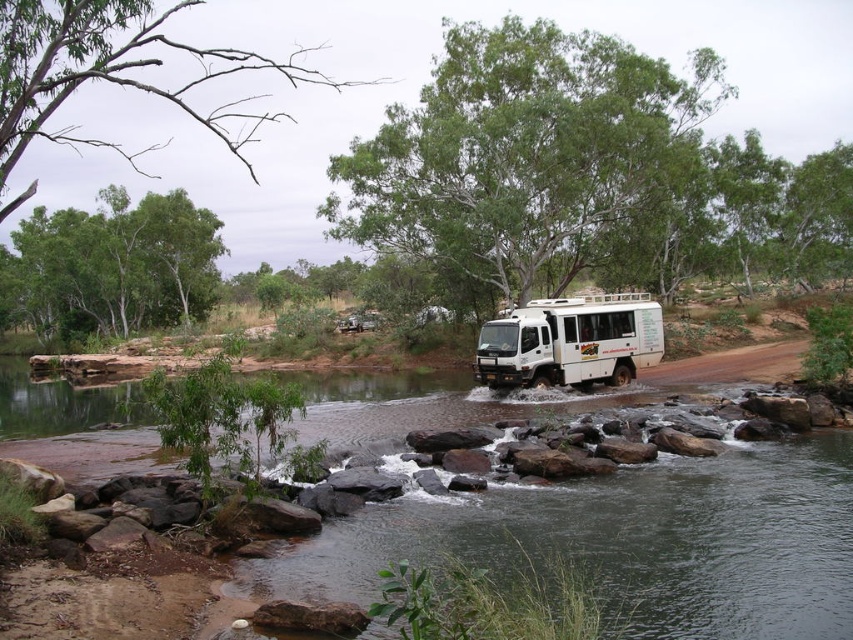
Question: Does green leafy tree at center appear under white matte camper at center?

Choices:
 (A) yes
 (B) no

Answer: (B)

Question: Among these points, which one is farthest from the camera?

Choices:
 (A) (634, 298)
 (B) (241, 118)

Answer: (B)

Question: Is dead wood branches at upper left bigger than white matte camper at center?

Choices:
 (A) yes
 (B) no

Answer: (A)

Question: Which point is farther from the camera taking this photo?

Choices:
 (A) (393, 109)
 (B) (55, 96)

Answer: (A)

Question: Is green leafy tree at center positioned behind green leafy tree at upper left?

Choices:
 (A) no
 (B) yes

Answer: (A)

Question: Which of the following is the farthest from the observer?

Choices:
 (A) white matte camper at center
 (B) green leafy tree at center
 (C) green leafy tree at upper left
 (D) dead wood branches at upper left

Answer: (C)